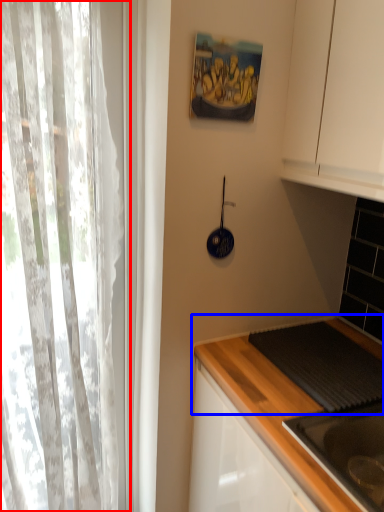
Question: Which object appears farthest to the camera in this image, curtain (highlighted by a red box) or countertop (highlighted by a blue box)?

Choices:
 (A) curtain
 (B) countertop

Answer: (B)